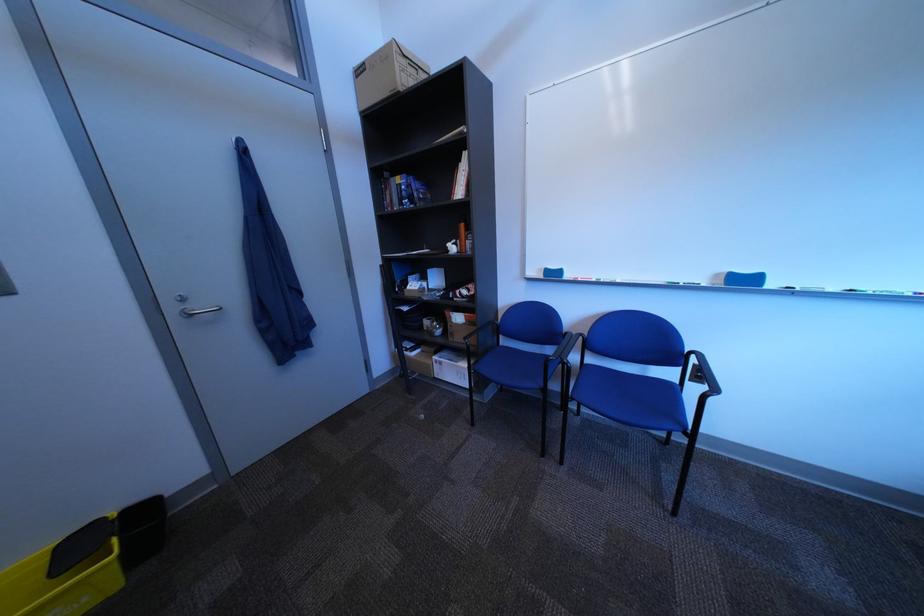
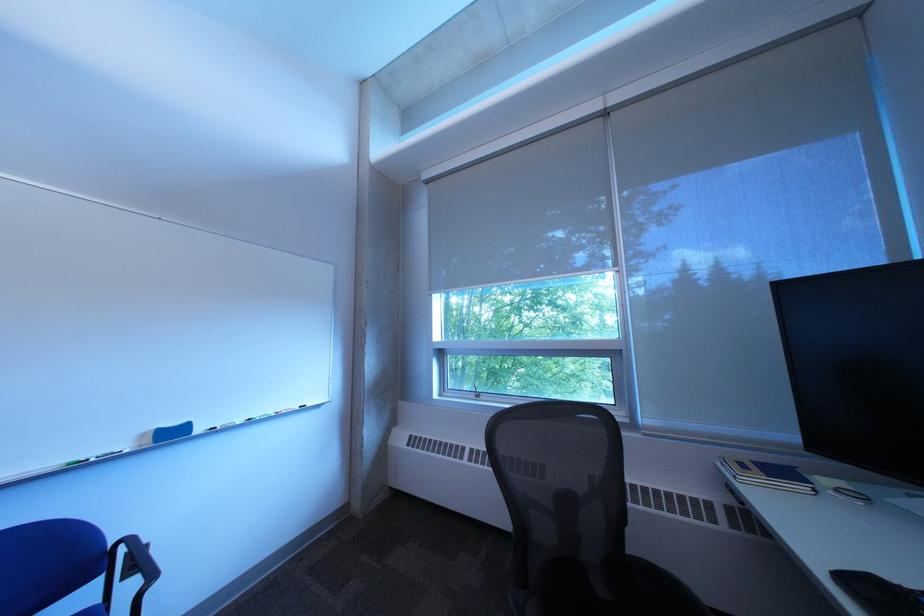
Question: The camera is either moving clockwise (left) or counter-clockwise (right) around the object. The first image is from the beginning of the video and the second image is from the end. Is the camera moving left or right when shooting the video?

Choices:
 (A) Left
 (B) Right

Answer: (A)